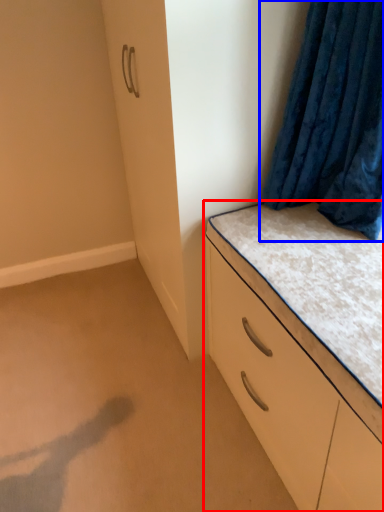
Question: Which object appears closest to the camera in this image, chest of drawers (highlighted by a red box) or curtain (highlighted by a blue box)?

Choices:
 (A) chest of drawers
 (B) curtain

Answer: (A)